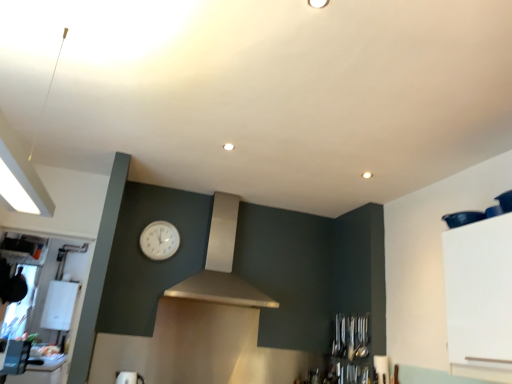
Question: Should I look upward or downward to see white plastic toaster at lower left, the 2th appliance from the back?

Choices:
 (A) down
 (B) up

Answer: (A)

Question: From the image's perspective, is white plastic clock at center located above white plastic toaster at lower left, the 2th appliance from the back?

Choices:
 (A) no
 (B) yes

Answer: (B)

Question: Does white plastic clock at center lie in front of white plastic toaster at lower left, which appears as the first appliance when viewed from the front?

Choices:
 (A) yes
 (B) no

Answer: (B)

Question: From the image's perspective, would you say white plastic clock at center is shown under white plastic toaster at lower left, arranged as the 1th appliance when viewed from the right?

Choices:
 (A) yes
 (B) no

Answer: (B)

Question: Does white plastic clock at center touch white plastic toaster at lower left, the 2th appliance from the back?

Choices:
 (A) yes
 (B) no

Answer: (B)

Question: From a real-world perspective, is white plastic clock at center under white plastic toaster at lower left, arranged as the 1th appliance when viewed from the right?

Choices:
 (A) yes
 (B) no

Answer: (B)

Question: Can you confirm if white plastic clock at center is positioned to the left of white plastic toaster at lower left, arranged as the 1th appliance when viewed from the right?

Choices:
 (A) yes
 (B) no

Answer: (B)

Question: Would you say satin white vent at center contains white plastic boiler at left, which is the 2th appliance in front-to-back order?

Choices:
 (A) no
 (B) yes

Answer: (A)

Question: Can you confirm if satin white vent at center is positioned to the right of white plastic boiler at left, which is counted as the 1th appliance, starting from the left?

Choices:
 (A) no
 (B) yes

Answer: (B)

Question: Does satin white vent at center have a smaller size compared to white plastic boiler at left, the first appliance viewed from the back?

Choices:
 (A) no
 (B) yes

Answer: (A)

Question: Is satin white vent at center located outside white plastic boiler at left, which is counted as the 1th appliance, starting from the left?

Choices:
 (A) no
 (B) yes

Answer: (B)

Question: Considering the relative positions of satin white vent at center and white plastic boiler at left, the first appliance viewed from the back, in the image provided, is satin white vent at center in front of white plastic boiler at left, the first appliance viewed from the back,?

Choices:
 (A) yes
 (B) no

Answer: (A)

Question: From a real-world perspective, is satin white vent at center located higher than white plastic boiler at left, the second appliance in the right-to-left sequence?

Choices:
 (A) yes
 (B) no

Answer: (A)

Question: Is white plastic clock at center at the left side of satin white vent at center?

Choices:
 (A) no
 (B) yes

Answer: (B)